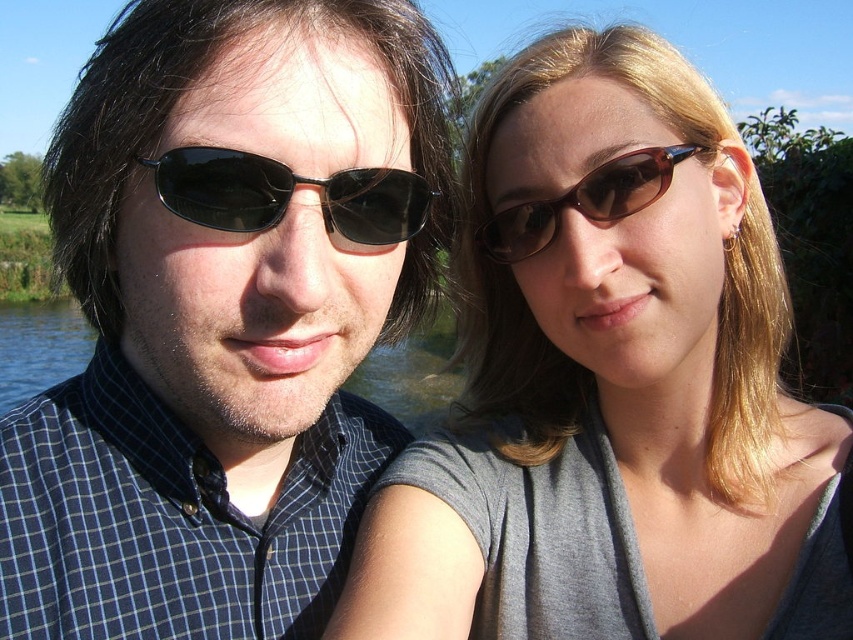
You are trying to decide which object is on the left side between the matte gray shirt at center and the black matte sunglasses at left. Based on the scene, which one is more to the left?

The black matte sunglasses at left is more to the left because the matte gray shirt at center is positioned on the right side of it.

You are a photographer trying to capture a closeup shot of the matte gray shirt at center and the brown matte sunglasses at upper center. Which object should you zoom in more on to ensure both are in focus?

The matte gray shirt at center is larger than the brown matte sunglasses at upper center, so you should zoom in more on the brown matte sunglasses at upper center to ensure both are in focus.